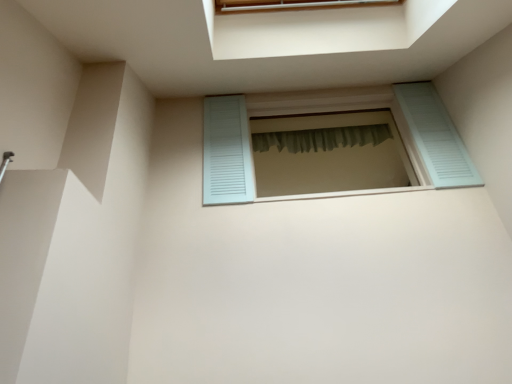
Locate an element on the screen. light blue wooden window at center is located at coordinates (396, 123).

The height and width of the screenshot is (384, 512). Describe the element at coordinates (396, 123) in the screenshot. I see `light blue wooden window at center` at that location.

In order to face light blue wooden window at center, should I rotate leftwards or rightwards?

You should look right and rotate roughly 9.430 degrees.

This screenshot has width=512, height=384. Identify the location of green sheer curtain at center. (321, 138).

This screenshot has height=384, width=512. What do you see at coordinates (321, 138) in the screenshot?
I see `green sheer curtain at center` at bounding box center [321, 138].

Locate an element on the screen. The width and height of the screenshot is (512, 384). light blue wooden window at center is located at coordinates (396, 123).

Based on their positions, is green sheer curtain at center located to the left or right of light blue wooden window at center?

Clearly, green sheer curtain at center is on the right of light blue wooden window at center in the image.

Considering the positions of objects green sheer curtain at center and light blue wooden window at center in the image provided, who is in front, green sheer curtain at center or light blue wooden window at center?

light blue wooden window at center is in front.

Is point (298, 131) behind point (425, 136)?

That is True.

From the image's perspective, between green sheer curtain at center and light blue wooden window at center, which one is located above?

From the image's view, green sheer curtain at center is above.

From a real-world perspective, which is physically above, green sheer curtain at center or light blue wooden window at center?

green sheer curtain at center, from a real-world perspective.

Between green sheer curtain at center and light blue wooden window at center, which one has smaller width?

green sheer curtain at center.

Considering the relative sizes of green sheer curtain at center and light blue wooden window at center in the image provided, is green sheer curtain at center taller than light blue wooden window at center?

Incorrect, the height of green sheer curtain at center is not larger of that of light blue wooden window at center.

Between green sheer curtain at center and light blue wooden window at center, which one has smaller size?

Smaller between the two is green sheer curtain at center.

Is green sheer curtain at center not within light blue wooden window at center?

green sheer curtain at center lies outside light blue wooden window at center's area.

Is green sheer curtain at center not near light blue wooden window at center?

No, green sheer curtain at center is in close proximity to light blue wooden window at center.

Is green sheer curtain at center oriented away from light blue wooden window at center?

No, green sheer curtain at center is not facing the opposite direction of light blue wooden window at center.

How far apart are green sheer curtain at center and light blue wooden window at center?

green sheer curtain at center is 14.88 inches away from light blue wooden window at center.

Locate an element on the screen. This screenshot has width=512, height=384. window that appears on the left of green sheer curtain at center is located at coordinates (396, 123).

Is light blue wooden window at center to the left or to the right of green sheer curtain at center in the image?

From the image, it's evident that light blue wooden window at center is to the left of green sheer curtain at center.

Is light blue wooden window at center closer to camera compared to green sheer curtain at center?

Yes, light blue wooden window at center is closer to the viewer.

Is point (437, 188) closer to viewer compared to point (333, 130)?

Yes, it is in front of point (333, 130).

From the image's perspective, does light blue wooden window at center appear lower than green sheer curtain at center?

Yes, from the image's perspective, light blue wooden window at center is beneath green sheer curtain at center.

From a real-world perspective, is light blue wooden window at center on top of green sheer curtain at center?

Actually, light blue wooden window at center is physically below green sheer curtain at center in the real world.

Does light blue wooden window at center have a greater width compared to green sheer curtain at center?

Yes.

Which of these two, light blue wooden window at center or green sheer curtain at center, stands taller?

light blue wooden window at center is taller.

Which of these two, light blue wooden window at center or green sheer curtain at center, is smaller?

green sheer curtain at center is smaller.

Would you say light blue wooden window at center contains green sheer curtain at center?

Definitely not — green sheer curtain at center is not inside light blue wooden window at center.

In the scene shown: Are light blue wooden window at center and green sheer curtain at center far apart?

No, light blue wooden window at center is not far from green sheer curtain at center.

Could you tell me if light blue wooden window at center is turned towards green sheer curtain at center?

No, light blue wooden window at center is not oriented towards green sheer curtain at center.

At what (x,y) coordinates should I click in order to perform the action: click on window in front of the green sheer curtain at center. Please return your answer as a coordinate pair (x, y). Looking at the image, I should click on (396, 123).

Where is `shower curtain above the light blue wooden window at center (from a real-world perspective)`? shower curtain above the light blue wooden window at center (from a real-world perspective) is located at coordinates (321, 138).

The image size is (512, 384). Identify the location of window below the green sheer curtain at center (from the image's perspective). (396, 123).